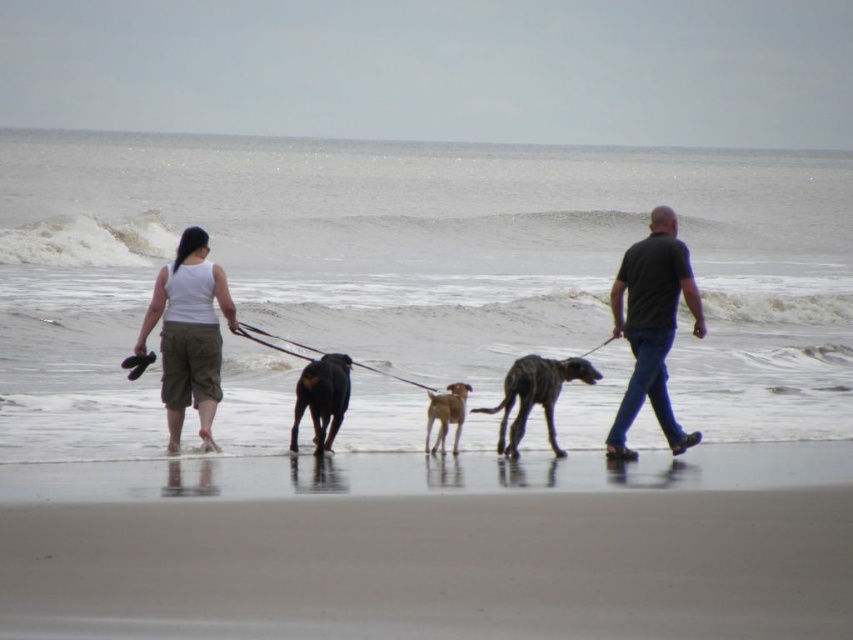
You are a photographer standing at the edge of the beach. You want to capture a photo of the smooth sand at lower center and the spotted fur dog at center. Which object should you zoom in on to make it appear larger in your photo?

The spotted fur dog at center is larger than the smooth sand at lower center, so you should zoom in on the spotted fur dog at center to make it appear larger in your photo.

You are standing at the camera position looking at the beach scene. Where is the smooth sand at lower center located in terms of coordinates?

The smooth sand at lower center is located at coordinates (434, 545).

You are standing at the edge of the beach and want to take a clear photo of the shiny black dog at center without the smooth sand at lower center reflecting too much light. Which object should you focus on to avoid reflections?

The smooth sand at lower center is positioned under the shiny black dog at center. To avoid reflections, focus on the shiny black dog at center instead of the sand below it.